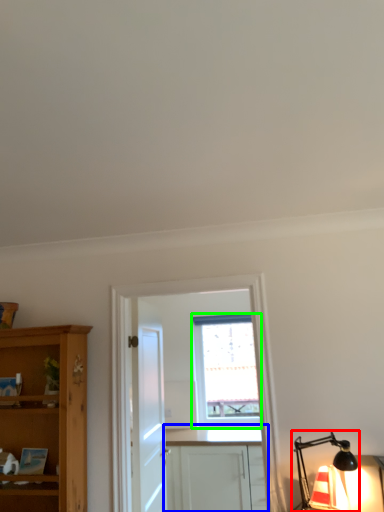
Question: Which object is positioned farthest from light fixture (highlighted by a red box)? Select from cabinetry (highlighted by a blue box) and window (highlighted by a green box).

Choices:
 (A) cabinetry
 (B) window

Answer: (B)